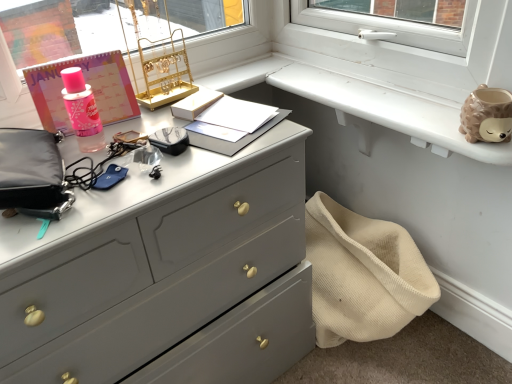
Question: From the image's perspective, is white matte window sill at upper right positioned above or below matte black pouch at left?

Choices:
 (A) below
 (B) above

Answer: (B)

Question: Which is correct: white matte window sill at upper right is inside matte black pouch at left, or outside of it?

Choices:
 (A) outside
 (B) inside

Answer: (A)

Question: Which object is the closest to the matte gray dresser at center?

Choices:
 (A) matte black pouch at left
 (B) gold metallic jewelry stand at upper center
 (C) white matte window sill at upper right

Answer: (A)

Question: Which is farther from the white matte window sill at upper right?

Choices:
 (A) gold metallic jewelry stand at upper center
 (B) matte gray dresser at center
 (C) matte black pouch at left

Answer: (C)